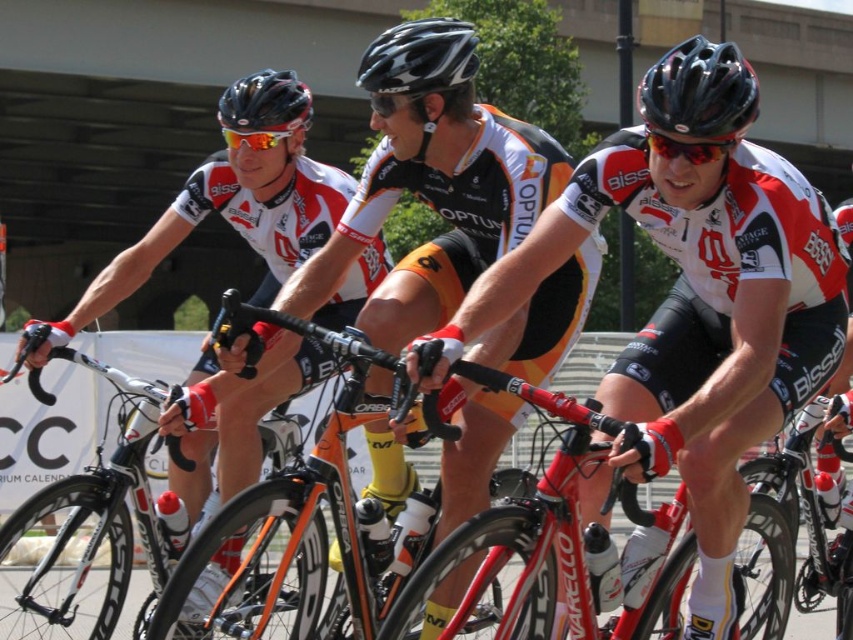
Question: Can you confirm if orange matte bicycle at center is bigger than shiny orange frame at center?

Choices:
 (A) no
 (B) yes

Answer: (B)

Question: Which of the following is the closest to the observer?

Choices:
 (A) white matte jersey at center
 (B) shiny orange frame at center
 (C) orange and black jersey at center
 (D) orange matte bicycle at center

Answer: (A)

Question: Can you confirm if black matte helmet at upper right is positioned to the right of matte black helmet at upper center?

Choices:
 (A) yes
 (B) no

Answer: (A)

Question: Can you confirm if white matte jersey at center is positioned above orange and black jersey at center?

Choices:
 (A) no
 (B) yes

Answer: (A)

Question: Estimate the real-world distances between objects in this image. Which object is farther from the shiny red bicycle at center?

Choices:
 (A) matte black helmet at upper center
 (B) black matte helmet at upper right
 (C) orange matte bicycle at center

Answer: (A)

Question: Which object is the closest to the matte black helmet at upper center?

Choices:
 (A) matte black bicycle at left
 (B) black matte bicycle helmet at center
 (C) orange matte bicycle at center

Answer: (A)